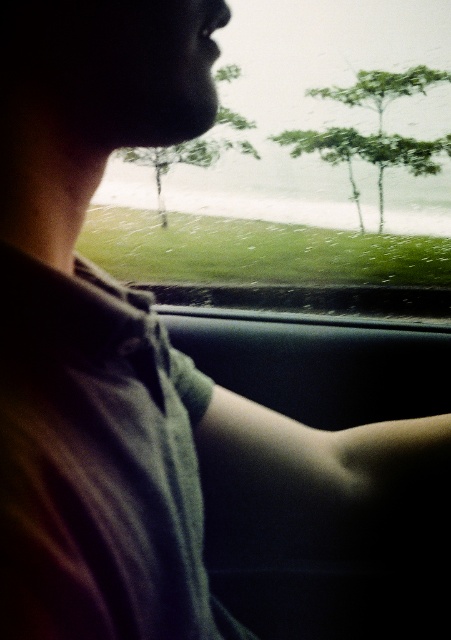
Question: Is green leafy tree at upper center bigger than green matte tree at center?

Choices:
 (A) yes
 (B) no

Answer: (A)

Question: Among these objects, which one is nearest to the camera?

Choices:
 (A) transparent glass windshield at upper center
 (B) green matte tree at center
 (C) green leafy tree at upper center

Answer: (B)

Question: Does transparent glass windshield at upper center have a smaller size compared to green leafy tree at upper center?

Choices:
 (A) no
 (B) yes

Answer: (B)

Question: Is transparent glass windshield at upper center thinner than green leafy tree at upper center?

Choices:
 (A) no
 (B) yes

Answer: (B)

Question: Which point is closer to the camera?

Choices:
 (A) (400, 148)
 (B) (216, 76)
 (C) (328, 172)

Answer: (B)

Question: Which point appears farthest from the camera in this image?

Choices:
 (A) (410, 42)
 (B) (390, 97)
 (C) (252, 129)

Answer: (A)